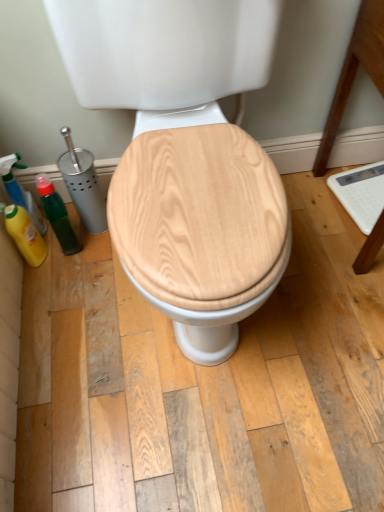
This screenshot has height=512, width=384. What do you see at coordinates (20, 191) in the screenshot?
I see `matte green spray bottle at left, marked as the 2th cleaning product in a bottom-to-top arrangement` at bounding box center [20, 191].

What do you see at coordinates (25, 234) in the screenshot? I see `yellow matte bottle at left, the 1th cleaning product positioned from the bottom` at bounding box center [25, 234].

The height and width of the screenshot is (512, 384). What are the coordinates of `green matte bottle at left` in the screenshot? It's located at (57, 215).

What do you see at coordinates (185, 156) in the screenshot? I see `wooden toilet seat at center` at bounding box center [185, 156].

I want to click on matte green spray bottle at left, the first cleaning product when ordered from top to bottom, so click(20, 191).

Is matte green spray bottle at left, the first cleaning product when ordered from top to bottom, placed right next to yellow matte bottle at left, the second cleaning product when ordered from top to bottom?

Yes, matte green spray bottle at left, the first cleaning product when ordered from top to bottom, is beside yellow matte bottle at left, the second cleaning product when ordered from top to bottom.

Is point (13, 166) farther from viewer compared to point (39, 239)?

No, it is not.

How different are the orientations of matte green spray bottle at left, the first cleaning product when ordered from top to bottom, and yellow matte bottle at left, the second cleaning product when ordered from top to bottom, in degrees?

The facing directions of matte green spray bottle at left, the first cleaning product when ordered from top to bottom, and yellow matte bottle at left, the second cleaning product when ordered from top to bottom, are 0.00334 degrees apart.

Considering the positions of objects matte green spray bottle at left, marked as the 2th cleaning product in a bottom-to-top arrangement, and yellow matte bottle at left, the second cleaning product when ordered from top to bottom, in the image provided, who is more to the right, matte green spray bottle at left, marked as the 2th cleaning product in a bottom-to-top arrangement, or yellow matte bottle at left, the second cleaning product when ordered from top to bottom,?

From the viewer's perspective, yellow matte bottle at left, the second cleaning product when ordered from top to bottom, appears more on the right side.

Find the location of a particular element. The height and width of the screenshot is (512, 384). the 2nd cleaning product to the left of the green matte bottle at left, starting your count from the anchor is located at coordinates (20, 191).

Could you tell me if green matte bottle at left is turned towards matte green spray bottle at left, the first cleaning product when ordered from top to bottom?

No, green matte bottle at left is not facing towards matte green spray bottle at left, the first cleaning product when ordered from top to bottom.

Is green matte bottle at left in front of or behind matte green spray bottle at left, the first cleaning product when ordered from top to bottom, in the image?

In the image, green matte bottle at left appears in front of matte green spray bottle at left, the first cleaning product when ordered from top to bottom.

Which object is positioned more to the right, green matte bottle at left or matte green spray bottle at left, marked as the 2th cleaning product in a bottom-to-top arrangement?

green matte bottle at left.

Is yellow matte bottle at left, the 1th cleaning product positioned from the bottom, looking in the opposite direction of matte green spray bottle at left, marked as the 2th cleaning product in a bottom-to-top arrangement?

Yes, yellow matte bottle at left, the 1th cleaning product positioned from the bottom, is facing away from matte green spray bottle at left, marked as the 2th cleaning product in a bottom-to-top arrangement.

From the image's perspective, relative to matte green spray bottle at left, the first cleaning product when ordered from top to bottom, is yellow matte bottle at left, the 1th cleaning product positioned from the bottom, above or below?

yellow matte bottle at left, the 1th cleaning product positioned from the bottom, is below matte green spray bottle at left, the first cleaning product when ordered from top to bottom.

Considering the relative sizes of yellow matte bottle at left, the 1th cleaning product positioned from the bottom, and matte green spray bottle at left, the first cleaning product when ordered from top to bottom, in the image provided, is yellow matte bottle at left, the 1th cleaning product positioned from the bottom, wider than matte green spray bottle at left, the first cleaning product when ordered from top to bottom,?

Yes, yellow matte bottle at left, the 1th cleaning product positioned from the bottom, is wider than matte green spray bottle at left, the first cleaning product when ordered from top to bottom.

Is matte green spray bottle at left, marked as the 2th cleaning product in a bottom-to-top arrangement, completely or partially inside yellow matte bottle at left, the 1th cleaning product positioned from the bottom?

Actually, matte green spray bottle at left, marked as the 2th cleaning product in a bottom-to-top arrangement, is outside yellow matte bottle at left, the 1th cleaning product positioned from the bottom.

Considering the relative sizes of green matte bottle at left and wooden toilet seat at center in the image provided, is green matte bottle at left shorter than wooden toilet seat at center?

Yes, green matte bottle at left is shorter than wooden toilet seat at center.

Is green matte bottle at left completely or partially outside of wooden toilet seat at center?

green matte bottle at left is positioned outside wooden toilet seat at center.

From the image's perspective, which object appears higher, green matte bottle at left or wooden toilet seat at center?

wooden toilet seat at center is shown above in the image.

Between point (53, 209) and point (248, 179), which one is positioned in front?

The point (248, 179) is in front.

Considering the points (12, 164) and (37, 189), which point is behind, point (12, 164) or point (37, 189)?

Positioned behind is point (37, 189).

Is matte green spray bottle at left, marked as the 2th cleaning product in a bottom-to-top arrangement, aimed at green matte bottle at left?

No, matte green spray bottle at left, marked as the 2th cleaning product in a bottom-to-top arrangement, is not oriented towards green matte bottle at left.

Is matte green spray bottle at left, marked as the 2th cleaning product in a bottom-to-top arrangement, closer to the viewer compared to green matte bottle at left?

No, matte green spray bottle at left, marked as the 2th cleaning product in a bottom-to-top arrangement, is further to the viewer.

From their relative heights in the image, would you say matte green spray bottle at left, the first cleaning product when ordered from top to bottom, is taller or shorter than green matte bottle at left?

In the image, matte green spray bottle at left, the first cleaning product when ordered from top to bottom, appears to be taller than green matte bottle at left.

Is yellow matte bottle at left, the second cleaning product when ordered from top to bottom, positioned beyond the bounds of green matte bottle at left?

Yes, yellow matte bottle at left, the second cleaning product when ordered from top to bottom, is not within green matte bottle at left.

Looking at this image, from the image's perspective, is yellow matte bottle at left, the second cleaning product when ordered from top to bottom, above or below green matte bottle at left?

yellow matte bottle at left, the second cleaning product when ordered from top to bottom, is situated lower than green matte bottle at left in the image.

Are yellow matte bottle at left, the 1th cleaning product positioned from the bottom, and green matte bottle at left far apart?

No, yellow matte bottle at left, the 1th cleaning product positioned from the bottom, is in close proximity to green matte bottle at left.

How many degrees apart are the facing directions of yellow matte bottle at left, the 1th cleaning product positioned from the bottom, and green matte bottle at left?

The angle between the facing direction of yellow matte bottle at left, the 1th cleaning product positioned from the bottom, and the facing direction of green matte bottle at left is 0.00537 degrees.

Consider the image. Is wooden toilet seat at center at the left side of green matte bottle at left?

In fact, wooden toilet seat at center is to the right of green matte bottle at left.

Could you tell me if wooden toilet seat at center is turned towards green matte bottle at left?

No, wooden toilet seat at center is not facing towards green matte bottle at left.

From the image's perspective, is wooden toilet seat at center above green matte bottle at left?

Correct, wooden toilet seat at center appears higher than green matte bottle at left in the image.

Based on their sizes in the image, would you say wooden toilet seat at center is bigger or smaller than green matte bottle at left?

Clearly, wooden toilet seat at center is larger in size than green matte bottle at left.

The image size is (384, 512). What are the coordinates of `cleaning product behind the matte green spray bottle at left, the first cleaning product when ordered from top to bottom` in the screenshot? It's located at (25, 234).

Identify the location of bottle above the matte green spray bottle at left, marked as the 2th cleaning product in a bottom-to-top arrangement (from a real-world perspective). This screenshot has height=512, width=384. (57, 215).

Looking at the image, which one is located closer to matte green spray bottle at left, the first cleaning product when ordered from top to bottom, green matte bottle at left or yellow matte bottle at left, the 1th cleaning product positioned from the bottom?

Among the two, yellow matte bottle at left, the 1th cleaning product positioned from the bottom, is located nearer to matte green spray bottle at left, the first cleaning product when ordered from top to bottom.

Estimate the real-world distances between objects in this image. Which object is closer to yellow matte bottle at left, the 1th cleaning product positioned from the bottom, matte green spray bottle at left, marked as the 2th cleaning product in a bottom-to-top arrangement, or wooden toilet seat at center?

The object closer to yellow matte bottle at left, the 1th cleaning product positioned from the bottom, is matte green spray bottle at left, marked as the 2th cleaning product in a bottom-to-top arrangement.

Looking at the image, which one is located further to yellow matte bottle at left, the second cleaning product when ordered from top to bottom, green matte bottle at left or matte green spray bottle at left, the first cleaning product when ordered from top to bottom?

Among the two, green matte bottle at left is located further to yellow matte bottle at left, the second cleaning product when ordered from top to bottom.

Considering their positions, is green matte bottle at left positioned closer to yellow matte bottle at left, the 1th cleaning product positioned from the bottom, than wooden toilet seat at center?

green matte bottle at left lies closer to yellow matte bottle at left, the 1th cleaning product positioned from the bottom, than the other object.

When comparing their distances from green matte bottle at left, does matte green spray bottle at left, the first cleaning product when ordered from top to bottom, or wooden toilet seat at center seem further?

wooden toilet seat at center lies further to green matte bottle at left than the other object.

Looking at the image, which one is located further to green matte bottle at left, wooden toilet seat at center or matte green spray bottle at left, the first cleaning product when ordered from top to bottom?

Among the two, wooden toilet seat at center is located further to green matte bottle at left.

Based on the photo, considering their positions, is wooden toilet seat at center positioned further to matte green spray bottle at left, marked as the 2th cleaning product in a bottom-to-top arrangement, than yellow matte bottle at left, the 1th cleaning product positioned from the bottom?

wooden toilet seat at center.

Consider the image. Estimate the real-world distances between objects in this image. Which object is closer to wooden toilet seat at center, green matte bottle at left or yellow matte bottle at left, the second cleaning product when ordered from top to bottom?

Among the two, green matte bottle at left is located nearer to wooden toilet seat at center.

What are the coordinates of `bottle between wooden toilet seat at center and yellow matte bottle at left, the second cleaning product when ordered from top to bottom, in the front-back direction` in the screenshot? It's located at (57, 215).

At what (x,y) coordinates should I click in order to perform the action: click on cleaning product located between wooden toilet seat at center and yellow matte bottle at left, the 1th cleaning product positioned from the bottom, in the depth direction. Please return your answer as a coordinate pair (x, y). The height and width of the screenshot is (512, 384). Looking at the image, I should click on [20, 191].

In order to click on bottle between matte green spray bottle at left, the first cleaning product when ordered from top to bottom, and yellow matte bottle at left, the second cleaning product when ordered from top to bottom, vertically in this screenshot , I will do 57,215.

Image resolution: width=384 pixels, height=512 pixels. In order to click on bottle located between wooden toilet seat at center and matte green spray bottle at left, the first cleaning product when ordered from top to bottom, in the depth direction in this screenshot , I will do `click(57, 215)`.